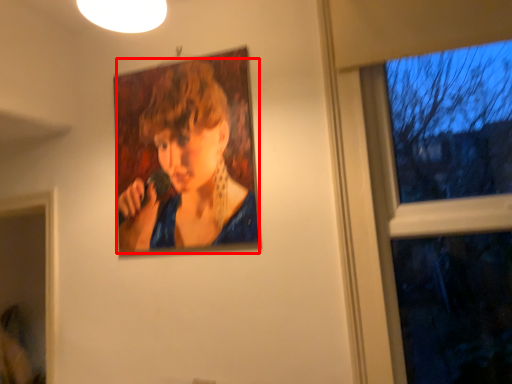
Question: From the image's perspective, considering the relative positions of person (annotated by the red box) and window in the image provided, where is person (annotated by the red box) located with respect to the staircase?

Choices:
 (A) below
 (B) above

Answer: (B)